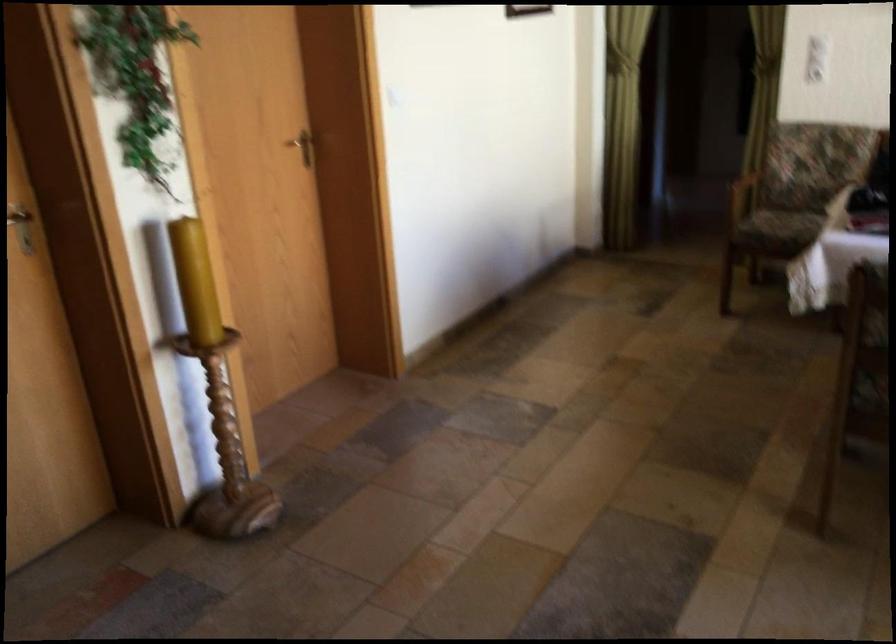
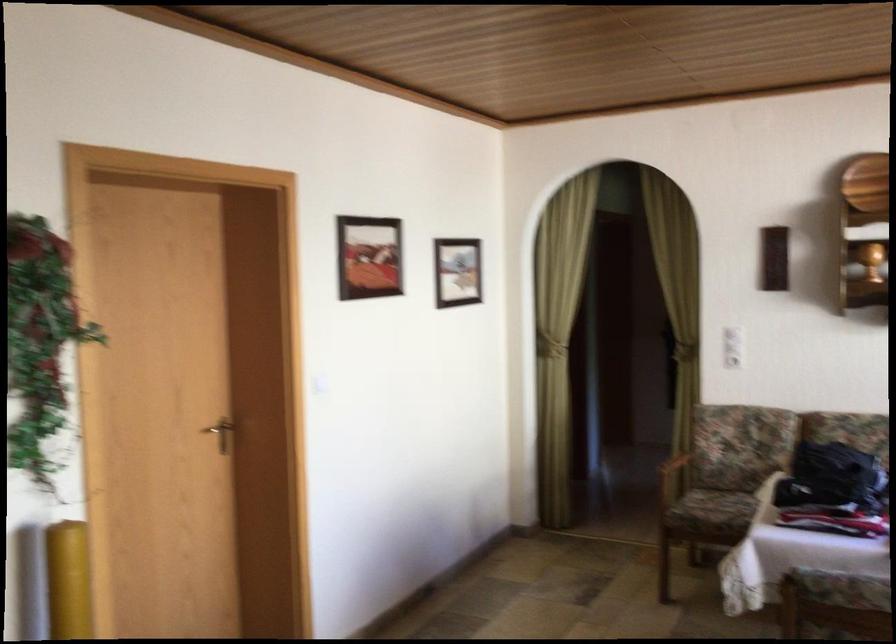
In the second image, find the point that corresponds to the point at 788,223 in the first image.

(725, 507)